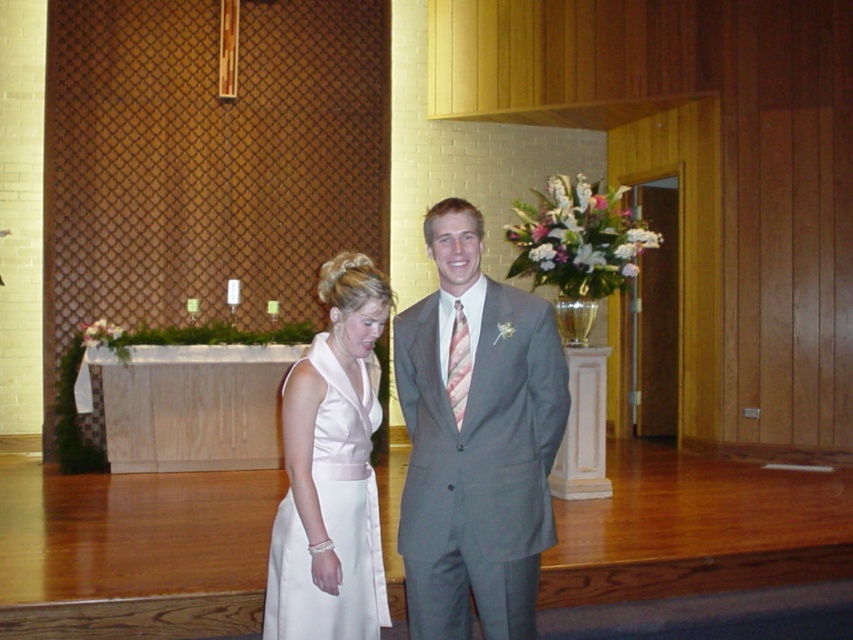
You are a photographer standing at the back of the venue. You want to take a photo of the gray suit at center and the white satin dress at center. Which one should you focus on first to ensure both are in sharp focus?

The gray suit at center is closer to the viewer than the white satin dress at center, so focus on the gray suit at center first to ensure both are in sharp focus.

You are a photographer at a wedding. You need to position two subjects in the frame so that their outfits are clearly visible. The gray suit at center and the white satin dress at center are both in the center. Which subject should you move to the side to avoid overlapping their outfits?

Since the gray suit at center is bigger than the white satin dress at center, you should move the gray suit at center to the side to avoid overlapping their outfits.